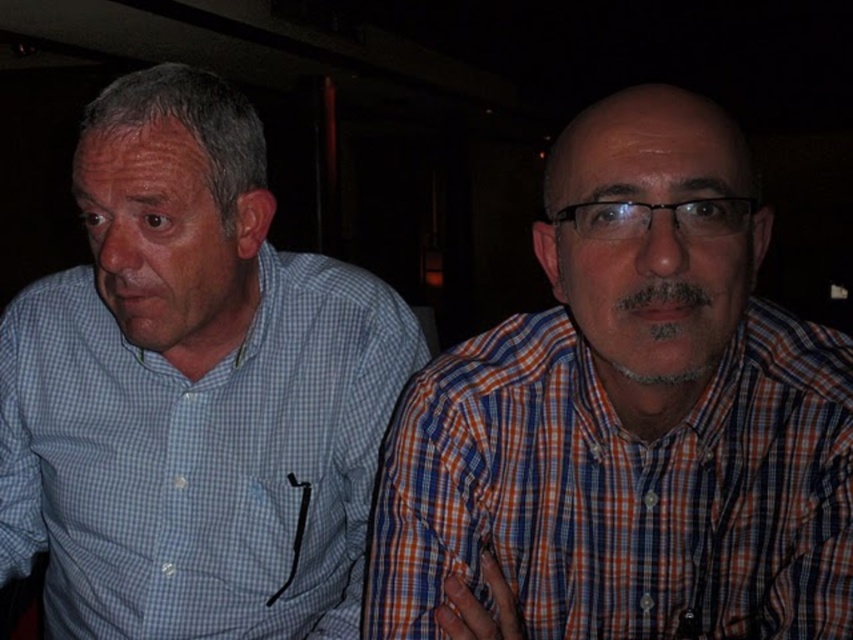
Can you confirm if blue checkered shirt at left is wider than black plastic glasses at center?

Yes, blue checkered shirt at left is wider than black plastic glasses at center.

Between point (296, 257) and point (741, 204), which one is positioned behind?

The point (296, 257) is behind.

What do you see at coordinates (192, 390) in the screenshot? I see `blue checkered shirt at left` at bounding box center [192, 390].

I want to click on blue checkered shirt at left, so coord(192,390).

Is orange plaid shirt at right below black plastic glasses at center?

Indeed, orange plaid shirt at right is positioned under black plastic glasses at center.

You are a GUI agent. You are given a task and a screenshot of the screen. Output one action in this format:
    pyautogui.click(x=<x>, y=<y>)
    Task: Click on the orange plaid shirt at right
    
    Given the screenshot: What is the action you would take?
    pyautogui.click(x=621, y=492)

Describe the element at coordinates (621, 492) in the screenshot. I see `orange plaid shirt at right` at that location.

Locate an element on the screen. orange plaid shirt at right is located at coordinates point(621,492).

Which of these two, blue checkered shirt at left or orange plaid shirt at right, stands shorter?

Standing shorter between the two is orange plaid shirt at right.

Does blue checkered shirt at left have a lesser width compared to orange plaid shirt at right?

No.

Is point (33, 497) positioned behind point (805, 611)?

Yes, point (33, 497) is behind point (805, 611).

Locate an element on the screen. This screenshot has height=640, width=853. blue checkered shirt at left is located at coordinates (x=192, y=390).